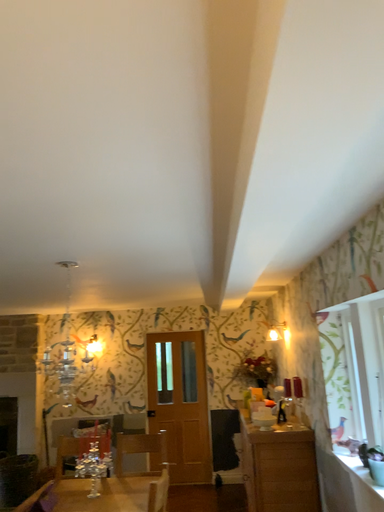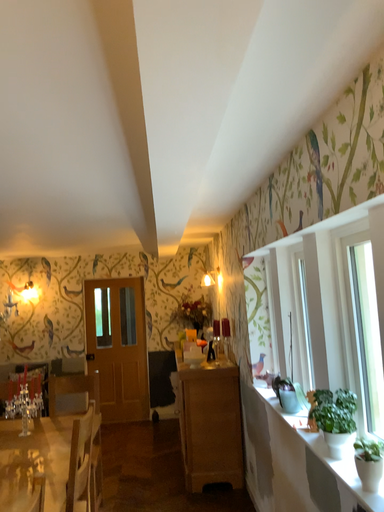
Question: How did the camera likely rotate when shooting the video?

Choices:
 (A) rotated left
 (B) rotated right

Answer: (B)